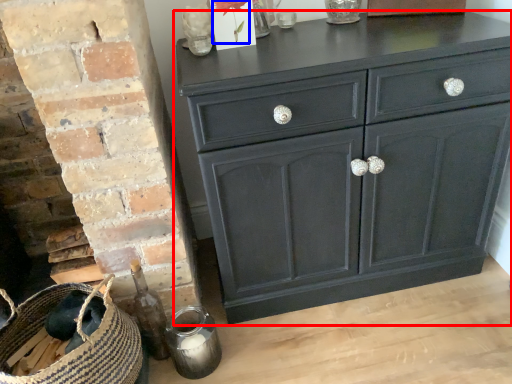
Question: Among these objects, which one is nearest to the camera, chest of drawers (highlighted by a red box) or flower (highlighted by a blue box)?

Choices:
 (A) chest of drawers
 (B) flower

Answer: (A)